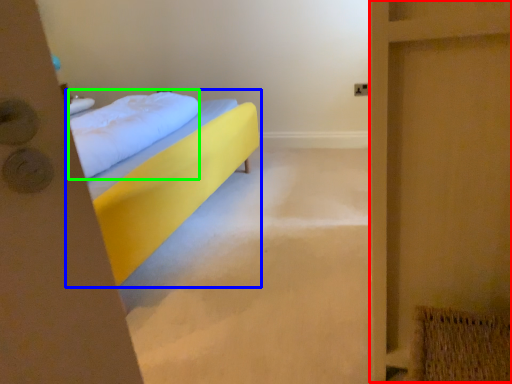
Question: Which is nearer to the screen door (highlighted by a red box)? bed (highlighted by a blue box) or pillow (highlighted by a green box).

Choices:
 (A) bed
 (B) pillow

Answer: (A)